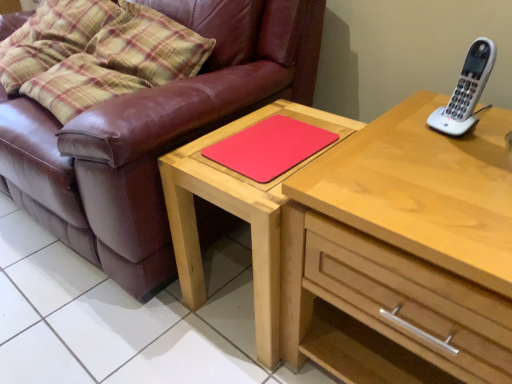
Locate an element on the screen. Image resolution: width=512 pixels, height=384 pixels. brown leather couch at left is located at coordinates (153, 135).

The height and width of the screenshot is (384, 512). Identify the location of white plastic phone at upper right. (466, 91).

You are a GUI agent. You are given a task and a screenshot of the screen. Output one action in this format:
    pyautogui.click(x=<x>, y=<y>)
    Task: Click on the matte wooden table at center
    The image size is (512, 384).
    Given the screenshot: What is the action you would take?
    pyautogui.click(x=238, y=214)

Based on the photo, from the image's perspective, between brown leather couch at left and matte wooden table at center, who is located below?

matte wooden table at center, from the image's perspective.

Does brown leather couch at left appear on the right side of matte wooden table at center?

No, brown leather couch at left is not to the right of matte wooden table at center.

Considering the relative positions of brown leather couch at left and matte wooden table at center in the image provided, is brown leather couch at left behind matte wooden table at center?

No, brown leather couch at left is closer to the camera.

Is rubberized red mousepad at center touching matte wooden table at center?

No, rubberized red mousepad at center is not with matte wooden table at center.

Who is bigger, rubberized red mousepad at center or matte wooden table at center?

With larger size is matte wooden table at center.

Locate an element on the screen. Image resolution: width=512 pixels, height=384 pixels. pad behind the matte wooden table at center is located at coordinates (269, 147).

Looking at their sizes, would you say rubberized red mousepad at center is wider or thinner than matte wooden table at center?

rubberized red mousepad at center is thinner than matte wooden table at center.

Which object is thinner, brown leather couch at left or white plastic phone at upper right?

Thinner between the two is white plastic phone at upper right.

Considering their positions, is brown leather couch at left located in front of or behind white plastic phone at upper right?

brown leather couch at left is positioned closer to the viewer than white plastic phone at upper right.

From the image's perspective, which one is positioned lower, brown leather couch at left or white plastic phone at upper right?

white plastic phone at upper right appears lower in the image.

Who is shorter, brown leather couch at left or white plastic phone at upper right?

Standing shorter between the two is white plastic phone at upper right.

From a real-world perspective, which is physically below, rubberized red mousepad at center or white plastic phone at upper right?

rubberized red mousepad at center.

Would you say rubberized red mousepad at center is to the left or to the right of white plastic phone at upper right in the picture?

rubberized red mousepad at center is positioned on white plastic phone at upper right's left side.

Is rubberized red mousepad at center facing towards white plastic phone at upper right?

No, rubberized red mousepad at center does not turn towards white plastic phone at upper right.

Considering the sizes of rubberized red mousepad at center and white plastic phone at upper right in the image, is rubberized red mousepad at center bigger or smaller than white plastic phone at upper right?

rubberized red mousepad at center is bigger than white plastic phone at upper right.

Does white plastic phone at upper right appear on the right side of brown leather couch at left?

Indeed, white plastic phone at upper right is positioned on the right side of brown leather couch at left.

Is white plastic phone at upper right facing away from brown leather couch at left?

No, white plastic phone at upper right is not facing away from brown leather couch at left.

Can you tell me how much white plastic phone at upper right and brown leather couch at left differ in facing direction?

12.8 degrees separate the facing orientations of white plastic phone at upper right and brown leather couch at left.

From the image's perspective, which object appears higher, rubberized red mousepad at center or light wood chest of drawers at upper right?

rubberized red mousepad at center is shown above in the image.

Is rubberized red mousepad at center smaller than light wood chest of drawers at upper right?

Correct, rubberized red mousepad at center occupies less space than light wood chest of drawers at upper right.

Considering the positions of points (231, 141) and (435, 177), is point (231, 141) closer to camera compared to point (435, 177)?

No, (231, 141) is further to viewer.

The height and width of the screenshot is (384, 512). Find the location of `pad above the light wood chest of drawers at upper right (from a real-world perspective)`. pad above the light wood chest of drawers at upper right (from a real-world perspective) is located at coordinates [x=269, y=147].

From a real-world perspective, who is located lower, rubberized red mousepad at center or brown leather couch at left?

In real-world perspective, brown leather couch at left is lower.

Is rubberized red mousepad at center next to brown leather couch at left?

There is a gap between rubberized red mousepad at center and brown leather couch at left.

Between rubberized red mousepad at center and brown leather couch at left, which one has smaller size?

rubberized red mousepad at center.

Locate an element on the screen. This screenshot has width=512, height=384. studio couch located above the matte wooden table at center (from the image's perspective) is located at coordinates (153, 135).

In the image, there is a rubberized red mousepad at center. Identify the location of table below it (from the image's perspective). The width and height of the screenshot is (512, 384). (238, 214).

When comparing their distances from brown leather couch at left, does rubberized red mousepad at center or light wood chest of drawers at upper right seem closer?

The object closer to brown leather couch at left is rubberized red mousepad at center.

Which object lies nearer to the anchor point rubberized red mousepad at center, white plastic phone at upper right or matte wooden table at center?

matte wooden table at center.

Considering their positions, is rubberized red mousepad at center positioned closer to brown leather couch at left than white plastic phone at upper right?

Among the two, rubberized red mousepad at center is located nearer to brown leather couch at left.

When comparing their distances from matte wooden table at center, does white plastic phone at upper right or rubberized red mousepad at center seem further?

Among the two, white plastic phone at upper right is located further to matte wooden table at center.

Estimate the real-world distances between objects in this image. Which object is closer to matte wooden table at center, white plastic phone at upper right or light wood chest of drawers at upper right?

The object closer to matte wooden table at center is light wood chest of drawers at upper right.

Based on their spatial positions, is brown leather couch at left or light wood chest of drawers at upper right closer to white plastic phone at upper right?

light wood chest of drawers at upper right lies closer to white plastic phone at upper right than the other object.

Looking at the image, which one is located closer to brown leather couch at left, light wood chest of drawers at upper right or white plastic phone at upper right?

Among the two, light wood chest of drawers at upper right is located nearer to brown leather couch at left.

When comparing their distances from light wood chest of drawers at upper right, does rubberized red mousepad at center or matte wooden table at center seem closer?

matte wooden table at center is positioned closer to the anchor light wood chest of drawers at upper right.

Where is `pad between brown leather couch at left and white plastic phone at upper right in the horizontal direction`? Image resolution: width=512 pixels, height=384 pixels. pad between brown leather couch at left and white plastic phone at upper right in the horizontal direction is located at coordinates (269, 147).

Locate an element on the screen. table located between rubberized red mousepad at center and white plastic phone at upper right in the left-right direction is located at coordinates point(238,214).

I want to click on pad located between brown leather couch at left and matte wooden table at center in the left-right direction, so click(x=269, y=147).

Identify the location of the chest of drawers situated between brown leather couch at left and white plastic phone at upper right from left to right. This screenshot has height=384, width=512. (403, 251).